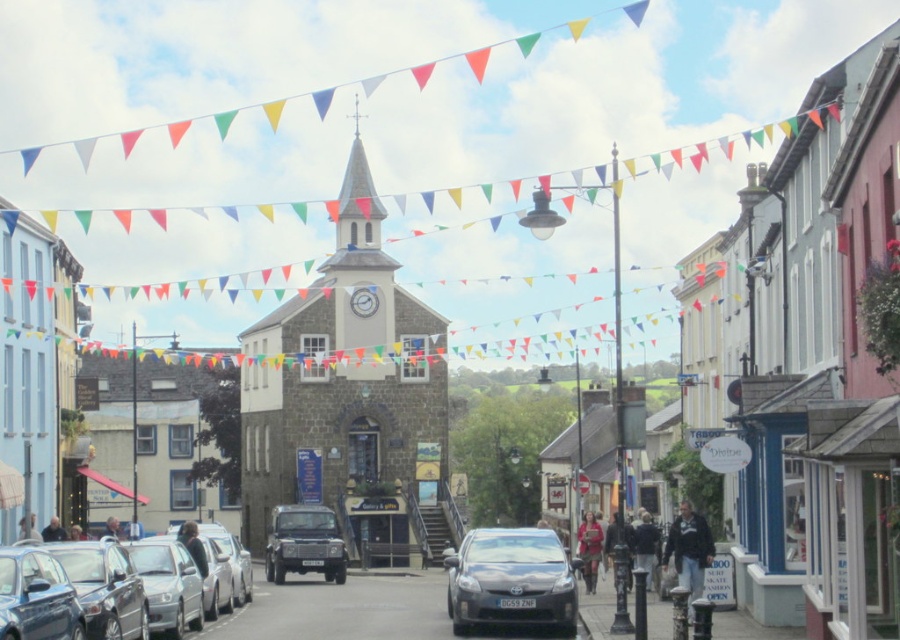
Which is more to the right, stone clock tower at center or metallic blue car at lower left?

stone clock tower at center is more to the right.

Who is positioned more to the left, stone clock tower at center or metallic blue car at lower left?

Positioned to the left is metallic blue car at lower left.

Between point (272, 387) and point (1, 566), which one is positioned in front?

Point (1, 566)

Identify the location of stone clock tower at center. (344, 385).

From the picture: Does stone clock tower at center appear on the left side of matte black suv at center?

In fact, stone clock tower at center is to the right of matte black suv at center.

Does stone clock tower at center have a smaller size compared to matte black suv at center?

No.

The image size is (900, 640). What do you see at coordinates (344, 385) in the screenshot?
I see `stone clock tower at center` at bounding box center [344, 385].

Identify the location of stone clock tower at center. (344, 385).

Which is more to the right, metallic silver car at center or metallic blue car at lower left?

From the viewer's perspective, metallic blue car at lower left appears more on the right side.

I want to click on metallic silver car at center, so click(x=165, y=573).

Between point (140, 556) and point (19, 612), which one is positioned behind?

The point (140, 556) is more distant.

The height and width of the screenshot is (640, 900). Find the location of `metallic silver car at center`. metallic silver car at center is located at coordinates (165, 573).